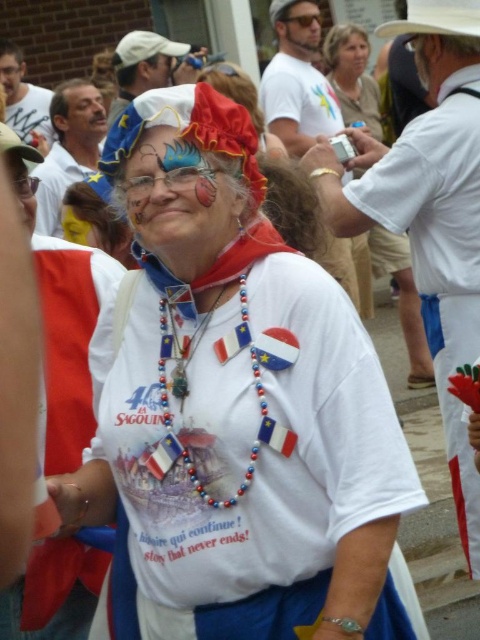
Does white fabric cowboy hat at upper center appear over matte plastic mask at center?

Incorrect, white fabric cowboy hat at upper center is not positioned above matte plastic mask at center.

Locate an element on the screen. The image size is (480, 640). white fabric cowboy hat at upper center is located at coordinates (435, 19).

Between white fabric shirt at center and white fabric cowboy hat at upper center, which one has less height?

white fabric cowboy hat at upper center

Is point (177, 236) behind point (439, 10)?

No, it is not.

At what (x,y) coordinates should I click in order to perform the action: click on white fabric shirt at center. Please return your answer as a coordinate pair (x, y). Looking at the image, I should click on (237, 410).

Locate an element on the screen. white fabric shirt at center is located at coordinates (237, 410).

Which is above, white fabric shirt at center or matte plastic mask at center?

matte plastic mask at center is above.

Is white fabric shirt at center above matte plastic mask at center?

No, white fabric shirt at center is not above matte plastic mask at center.

The height and width of the screenshot is (640, 480). What are the coordinates of `white fabric shirt at center` in the screenshot? It's located at (237, 410).